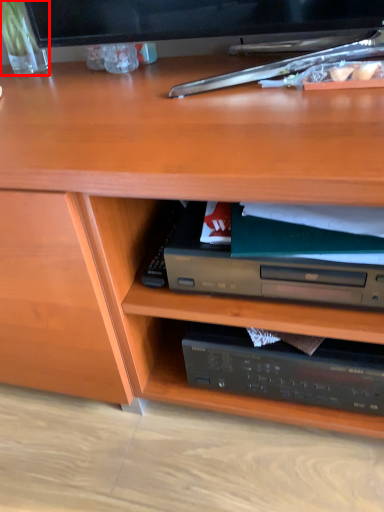
Question: From the image's perspective, considering the relative positions of glass vase (annotated by the red box) and paperback book in the image provided, where is glass vase (annotated by the red box) located with respect to the staircase?

Choices:
 (A) below
 (B) above

Answer: (B)